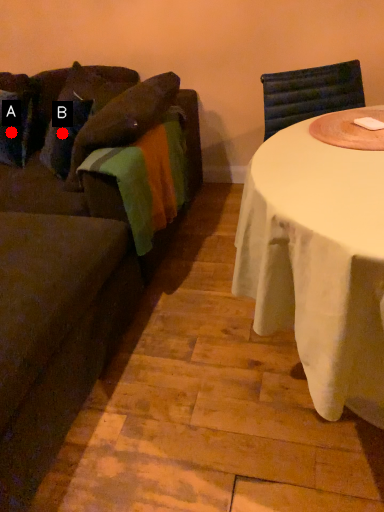
Question: Two points are circled on the image, labeled by A and B beside each circle. Which point is farther to the camera?

Choices:
 (A) A is further
 (B) B is further

Answer: (A)